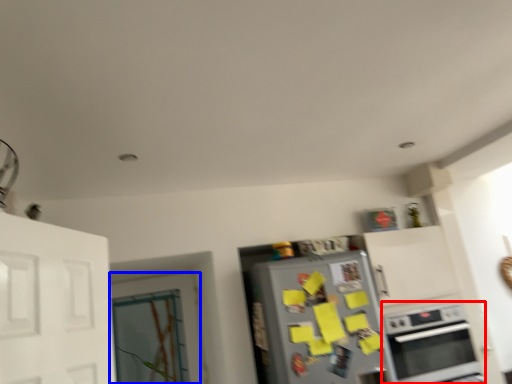
Question: Which point is further to the camera, oven (highlighted by a red box) or door (highlighted by a blue box)?

Choices:
 (A) oven
 (B) door

Answer: (B)